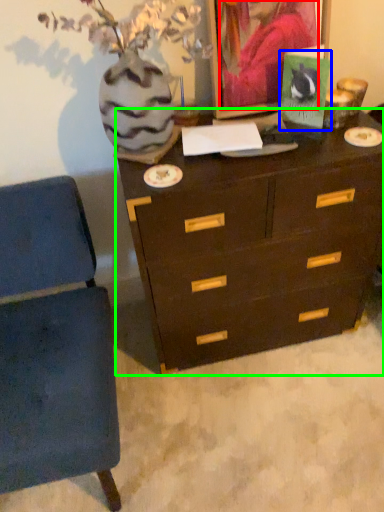
Question: Which is farther away from person (highlighted by a red box)? postcard (highlighted by a blue box) or chest of drawers (highlighted by a green box)?

Choices:
 (A) postcard
 (B) chest of drawers

Answer: (B)